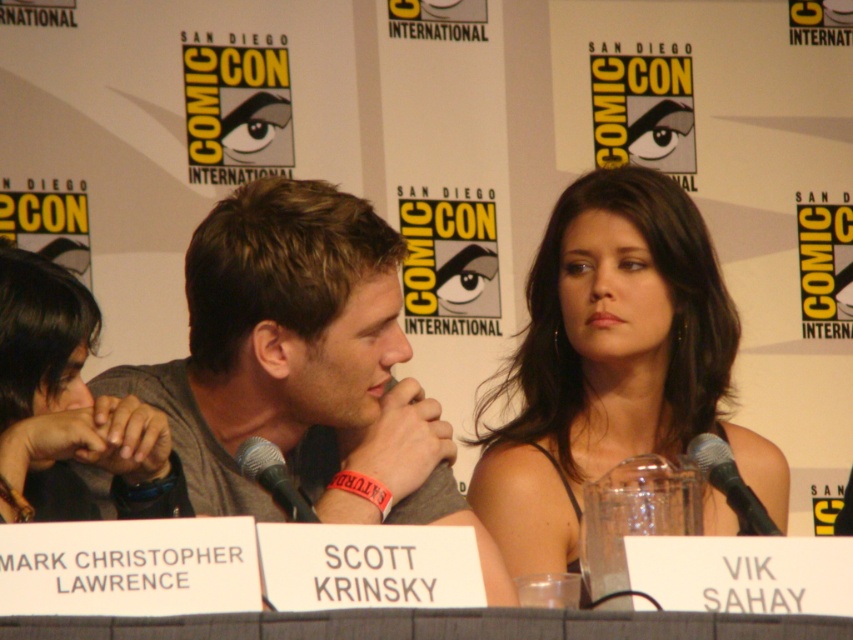
You are a photographer at the event and want to capture a closeup of the black metallic microphone at center and the black plastic microphone at center. Which microphone is positioned closer to the camera?

The black metallic microphone at center is closer to the viewer than the black plastic microphone at center, so the black metallic microphone at center would appear closer to the camera.